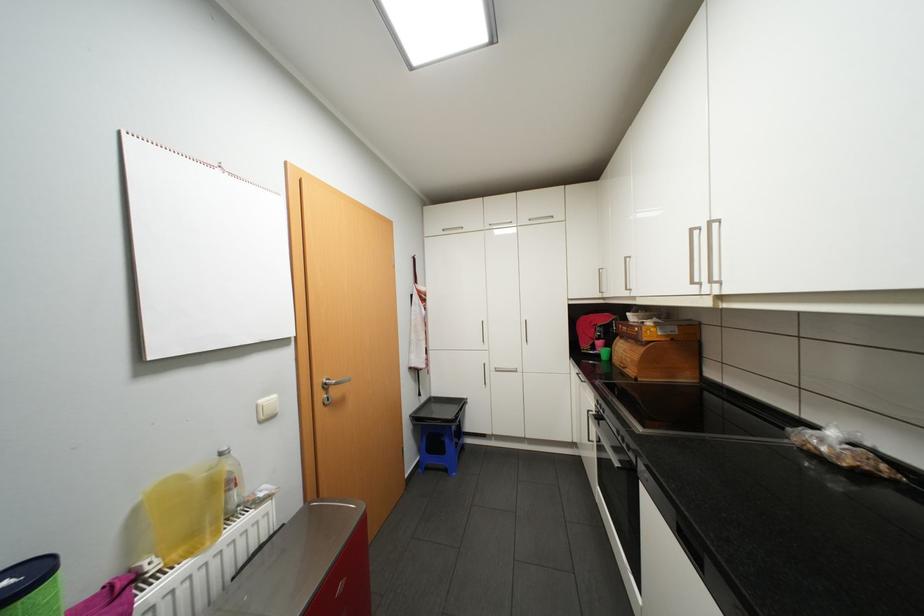
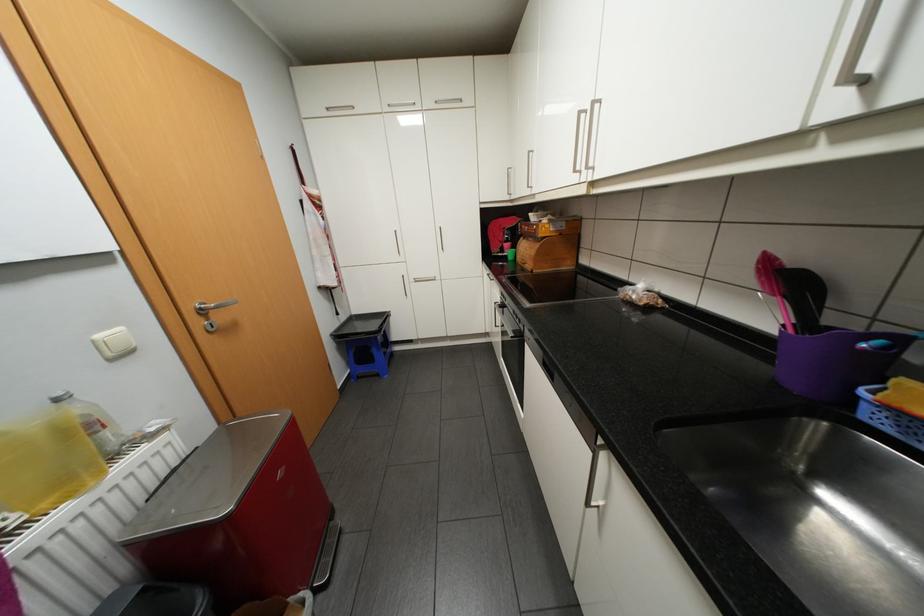
Find the pixel in the second image that matches (334,383) in the first image.

(209, 308)